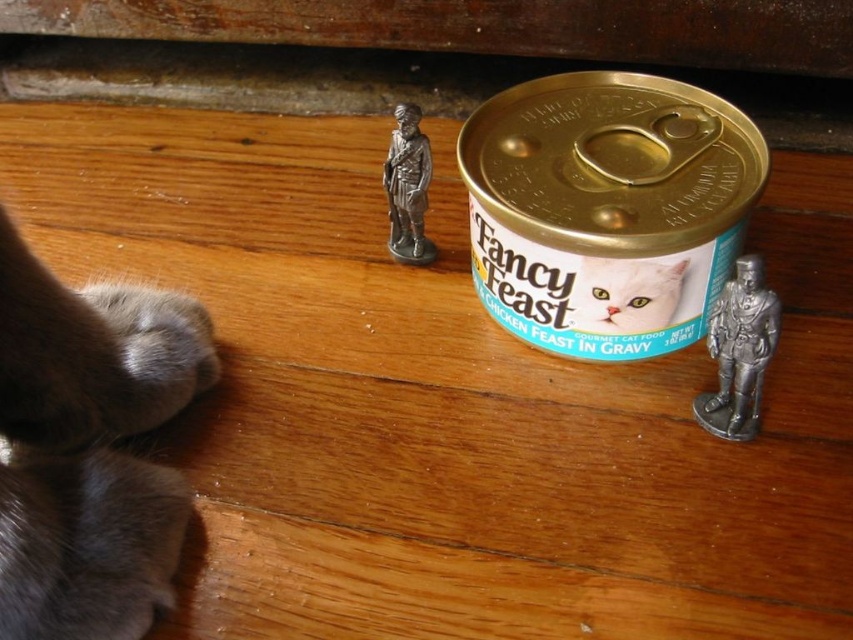
From the picture: You are a cat observing the scene. You see the fuzzy fur paw at lower left and the white glossy cat food can at center. Which object is nearer to you?

The fuzzy fur paw at lower left is closer to you than the white glossy cat food can at center.

You are a cat trying to reach the can of Fancy Feast Chicken Feast in Gravy. You see two points marked on the floor. One is at point (729, 388) and the other at point (663, 304). Which point is closer to the can?

Point (729, 388) is in front of point (663, 304), so the point at (729, 388) is closer to the can.